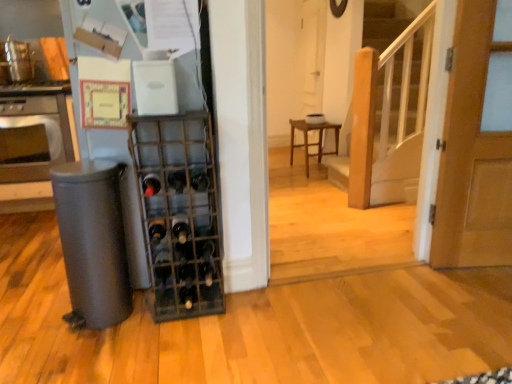
Question: Is white matte switch at upper center, the 1th appliance when ordered from top to bottom, spatially inside satin silver oven at left, or outside of it?

Choices:
 (A) inside
 (B) outside

Answer: (B)

Question: In terms of width, does white matte switch at upper center, which ranks as the second appliance in bottom-to-top order, look wider or thinner when compared to satin silver oven at left?

Choices:
 (A) thin
 (B) wide

Answer: (A)

Question: Which object is positioned farthest from the black glass wine bottle at center, the 3th wine bottle ordered from the bottom?

Choices:
 (A) matte gray trash can at left, which ranks as the 2th appliance in top-to-bottom order
 (B) satin silver oven at left
 (C) dark green glass wine bottle at center, the fourth wine bottle when ordered from bottom to top
 (D) white matte screen door at center
 (E) black glass wine bottle at center, the first wine bottle from the bottom

Answer: (D)

Question: Estimate the real-world distances between objects in this image. Which object is farther from the wooden stool at center?

Choices:
 (A) metallic wine rack at center
 (B) matte gray trash can at left, the first appliance ordered from the bottom
 (C) white matte screen door at center
 (D) satin silver oven at left
 (E) dark green glass wine bottle at center, the fourth wine bottle when ordered from bottom to top

Answer: (B)